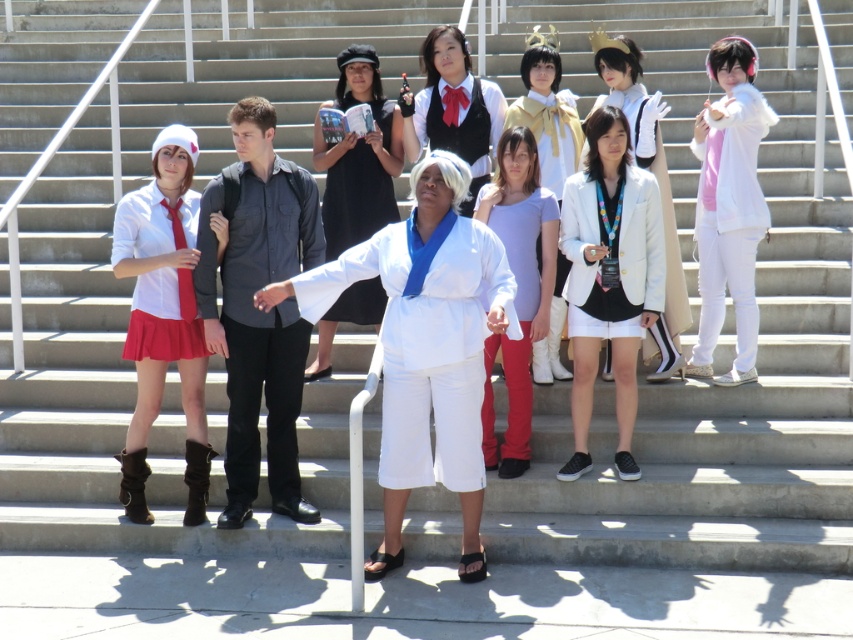
Question: Which object is farther from the camera taking this photo?

Choices:
 (A) matte white shirt at left
 (B) white matte blazer at center

Answer: (B)

Question: Based on their relative distances, which object is nearer to the black satin dress at center?

Choices:
 (A) white cotton karate uniform at center
 (B) matte white shirt at left
 (C) matte black shirt at center
 (D) matte yellow dress at center

Answer: (D)

Question: Where is white matte blazer at center located in relation to matte yellow dress at center in the image?

Choices:
 (A) left
 (B) right

Answer: (B)

Question: Which is farther from the white cotton karate uniform at center?

Choices:
 (A) matte white shirt at left
 (B) white matte jacket at center

Answer: (B)

Question: Does matte black shirt at center appear over white matte hoodie at right?

Choices:
 (A) no
 (B) yes

Answer: (A)

Question: Can you confirm if matte purple blouse at center is positioned to the right of matte black vest at center?

Choices:
 (A) no
 (B) yes

Answer: (B)